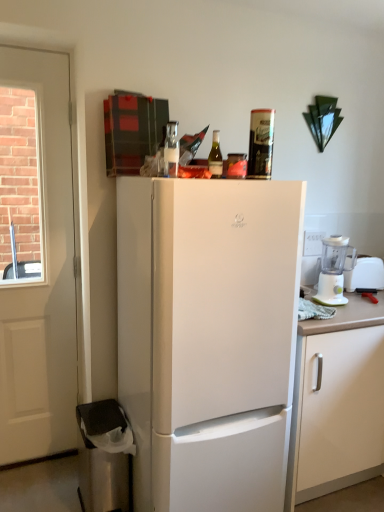
Find the location of a particular element. This screenshot has height=512, width=384. free space on the front side of white plastic blender at right is located at coordinates (356, 311).